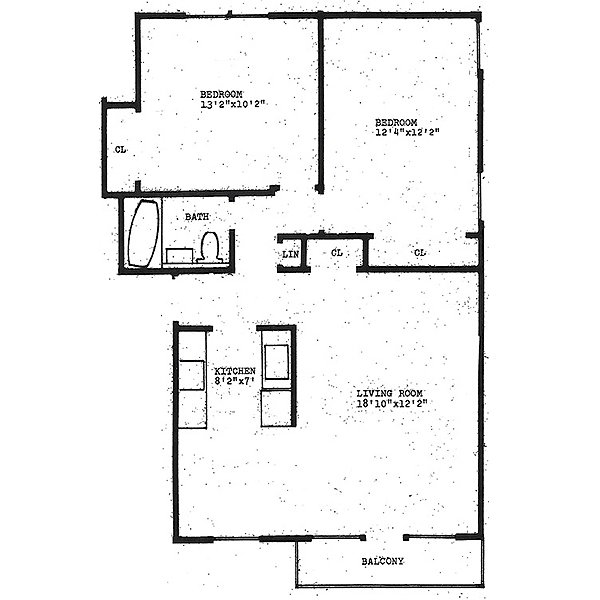
You are a GUI agent. You are given a task and a screenshot of the screen. Output one action in this format:
    pyautogui.click(x=<x>, y=<y>)
    Task: Click on the closet
    Image resolution: width=600 pixels, height=600 pixels.
    Given the screenshot: What is the action you would take?
    pyautogui.click(x=120, y=150), pyautogui.click(x=330, y=250), pyautogui.click(x=424, y=250)